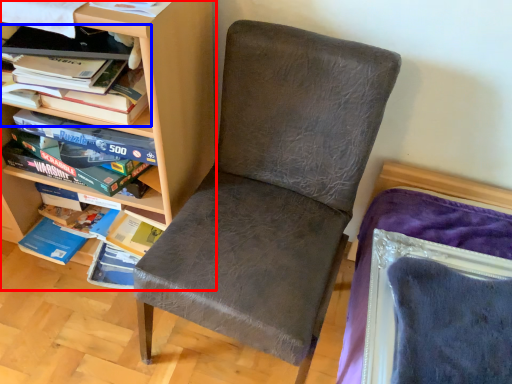
Question: Which object appears farthest to the camera in this image, shelf (highlighted by a red box) or book (highlighted by a blue box)?

Choices:
 (A) shelf
 (B) book

Answer: (B)